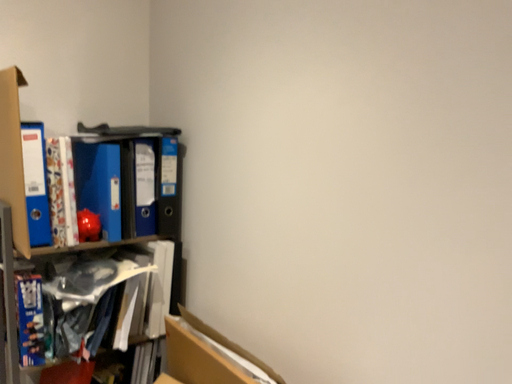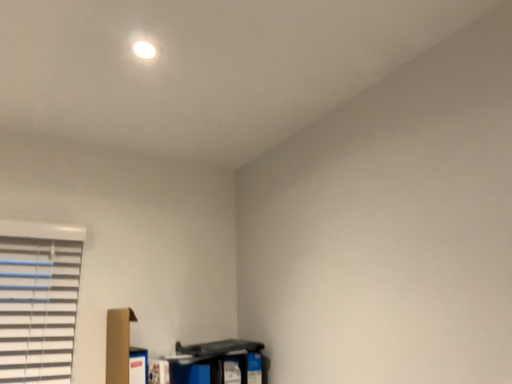
Question: Which way did the camera rotate in the video?

Choices:
 (A) rotated left
 (B) rotated right

Answer: (A)